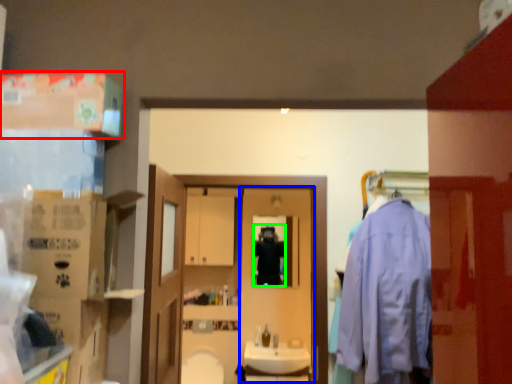
Question: Which is nearer to the box (highlighted by a red box)? screen door (highlighted by a blue box) or person (highlighted by a green box).

Choices:
 (A) screen door
 (B) person

Answer: (B)